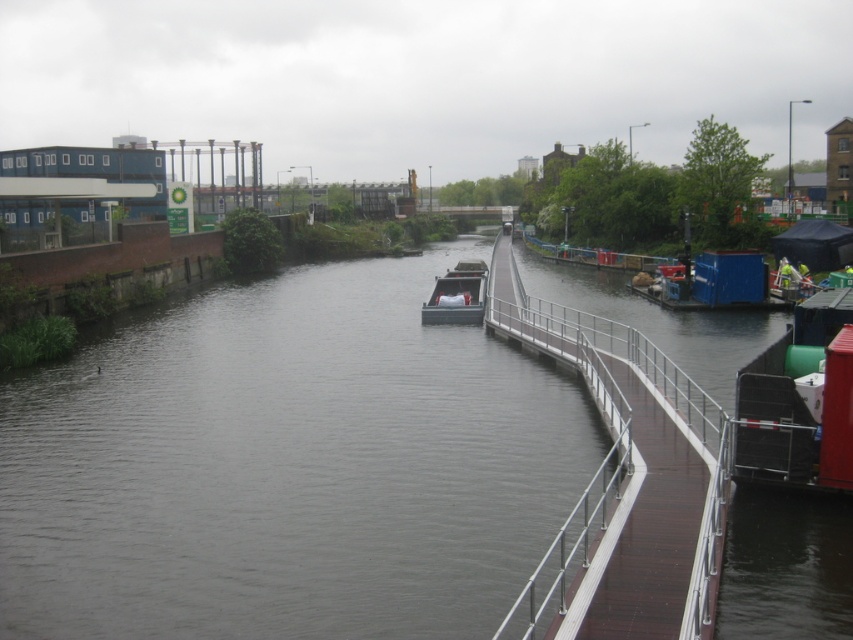
Based on the photo, is dark gray water at center closer to camera compared to dark gray metallic boat at center?

Yes, dark gray water at center is in front of dark gray metallic boat at center.

Between point (80, 426) and point (479, 307), which one is positioned in front?

Positioned in front is point (80, 426).

What are the coordinates of `dark gray water at center` in the screenshot? It's located at (285, 467).